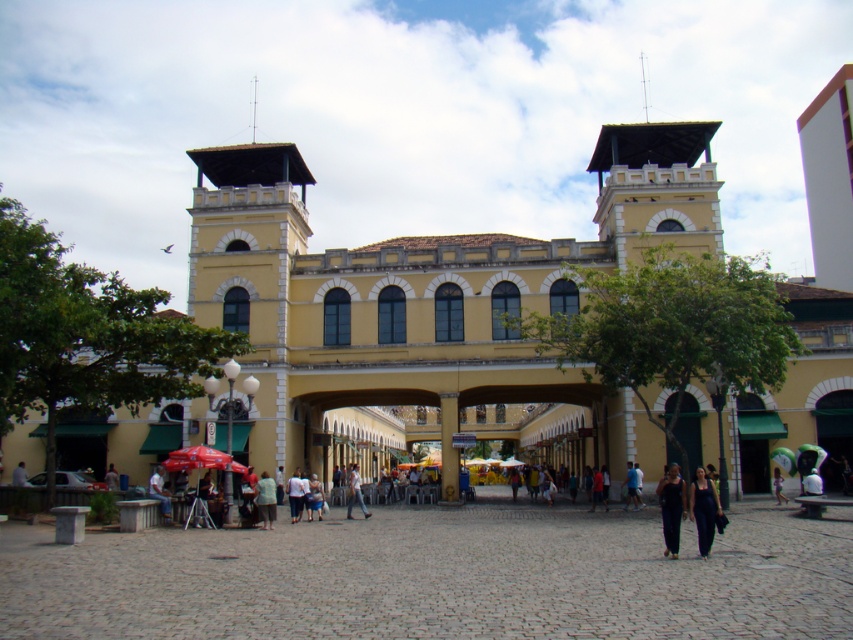
The width and height of the screenshot is (853, 640). What do you see at coordinates (671, 508) in the screenshot? I see `black matte pants at lower right` at bounding box center [671, 508].

Does black matte pants at lower right appear under light brown fabric pants at center?

No, black matte pants at lower right is not below light brown fabric pants at center.

The image size is (853, 640). What do you see at coordinates (671, 508) in the screenshot? I see `black matte pants at lower right` at bounding box center [671, 508].

What are the coordinates of `black matte pants at lower right` in the screenshot? It's located at (671, 508).

How far apart are yellow matte building at center and light brown wooden chair at lower left?

yellow matte building at center is 31.65 meters from light brown wooden chair at lower left.

Is point (252, 260) less distant than point (157, 474)?

No, it is behind (157, 474).

At what (x,y) coordinates should I click in order to perform the action: click on yellow matte building at center. Please return your answer as a coordinate pair (x, y). Looking at the image, I should click on (427, 292).

In the scene shown: Can you confirm if black matte pants at lower right is positioned above light blue jeans at center?

Indeed, black matte pants at lower right is positioned over light blue jeans at center.

What do you see at coordinates (671, 508) in the screenshot? This screenshot has height=640, width=853. I see `black matte pants at lower right` at bounding box center [671, 508].

Between point (664, 481) and point (351, 484), which one is positioned behind?

The point (351, 484) is more distant.

Identify the location of black matte pants at lower right. (671, 508).